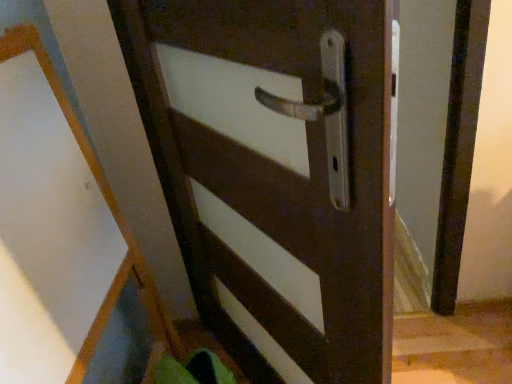
Measure the distance between point (237, 343) and camera.

4.44 feet.

You are a GUI agent. You are given a task and a screenshot of the screen. Output one action in this format:
    pyautogui.click(x=<x>, y=<y>)
    Task: Click on the dark wood door handle at center
    The height and width of the screenshot is (384, 512).
    Given the screenshot: What is the action you would take?
    pyautogui.click(x=282, y=176)

The width and height of the screenshot is (512, 384). What do you see at coordinates (282, 176) in the screenshot? I see `dark wood door handle at center` at bounding box center [282, 176].

The width and height of the screenshot is (512, 384). I want to click on dark wood door handle at center, so click(282, 176).